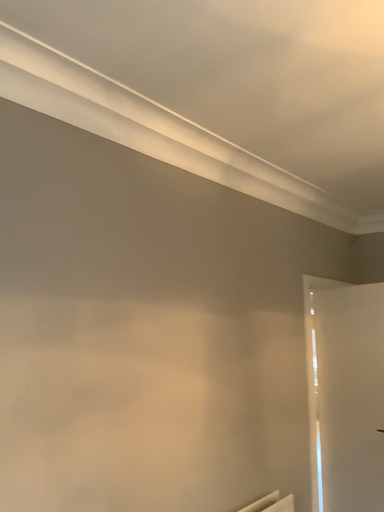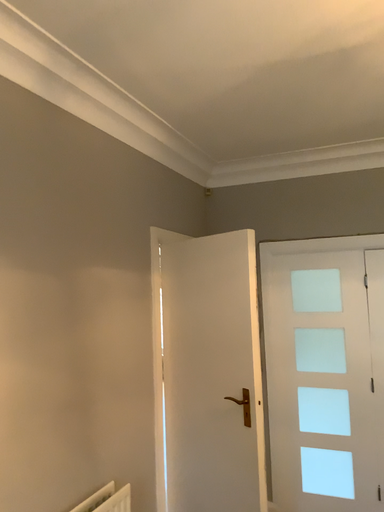
Question: Which way did the camera rotate in the video?

Choices:
 (A) rotated left
 (B) rotated right

Answer: (B)